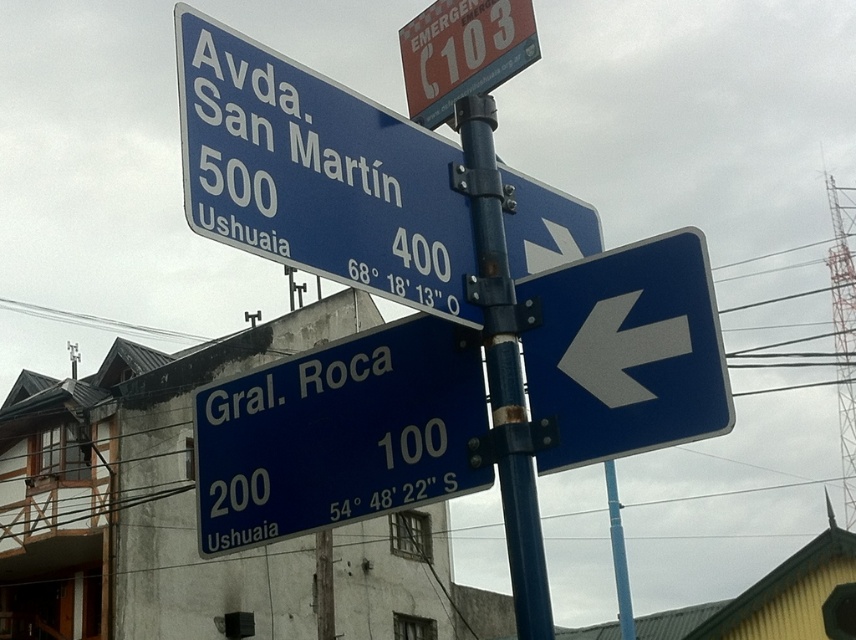
You are a pedestrian standing on the sidewalk facing the blue metallic street sign at upper center and the blue metallic sign at lower left. Which one is positioned higher relative to the other?

The blue metallic street sign at upper center is positioned higher than the blue metallic sign at lower left.

You are standing on the sidewalk and see the metallic blue pole at center and the metallic emergency sign at upper center. Which object is positioned to the right of the other?

The metallic blue pole at center is to the right of the metallic emergency sign at upper center.